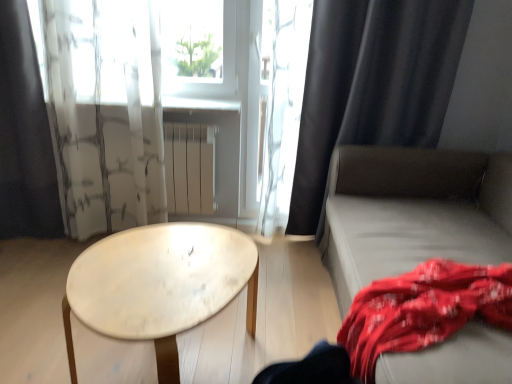
Question: Can you confirm if translucent white curtain at upper center, which ranks as the 2th curtain in left-to-right order, is bigger than red cotton blanket at lower right?

Choices:
 (A) no
 (B) yes

Answer: (A)

Question: Is translucent white curtain at upper center, the second curtain from the right, taller than red cotton blanket at lower right?

Choices:
 (A) yes
 (B) no

Answer: (A)

Question: Are translucent white curtain at upper center, the second curtain from the right, and red cotton blanket at lower right making contact?

Choices:
 (A) yes
 (B) no

Answer: (B)

Question: From the image's perspective, is translucent white curtain at upper center, the second curtain from the right, located beneath red cotton blanket at lower right?

Choices:
 (A) yes
 (B) no

Answer: (B)

Question: Would you say translucent white curtain at upper center, the second curtain from the right, contains red cotton blanket at lower right?

Choices:
 (A) yes
 (B) no

Answer: (B)

Question: From the image's perspective, is light gray fabric couch at right positioned above or below transparent glass window screen at upper center?

Choices:
 (A) below
 (B) above

Answer: (A)

Question: Looking at their shapes, would you say light gray fabric couch at right is wider or thinner than transparent glass window screen at upper center?

Choices:
 (A) wide
 (B) thin

Answer: (A)

Question: From a real-world perspective, relative to transparent glass window screen at upper center, is light gray fabric couch at right vertically above or below?

Choices:
 (A) above
 (B) below

Answer: (B)

Question: Visually, is light gray fabric couch at right positioned to the left or to the right of transparent glass window screen at upper center?

Choices:
 (A) left
 (B) right

Answer: (B)

Question: In the image, is transparent glass window screen at upper center positioned in front of or behind white matte radiator at center?

Choices:
 (A) behind
 (B) front

Answer: (B)

Question: Is transparent glass window screen at upper center inside the boundaries of white matte radiator at center, or outside?

Choices:
 (A) outside
 (B) inside

Answer: (A)

Question: Is transparent glass window screen at upper center wider or thinner than white matte radiator at center?

Choices:
 (A) thin
 (B) wide

Answer: (B)

Question: From a real-world perspective, is transparent glass window screen at upper center above or below white matte radiator at center?

Choices:
 (A) above
 (B) below

Answer: (A)

Question: In the image, is black fabric curtain at left, arranged as the 1th curtain when viewed from the left, positioned in front of or behind white matte radiator at center?

Choices:
 (A) behind
 (B) front

Answer: (B)

Question: Considering the positions of point (28, 233) and point (211, 195), is point (28, 233) closer or farther from the camera than point (211, 195)?

Choices:
 (A) farther
 (B) closer

Answer: (B)